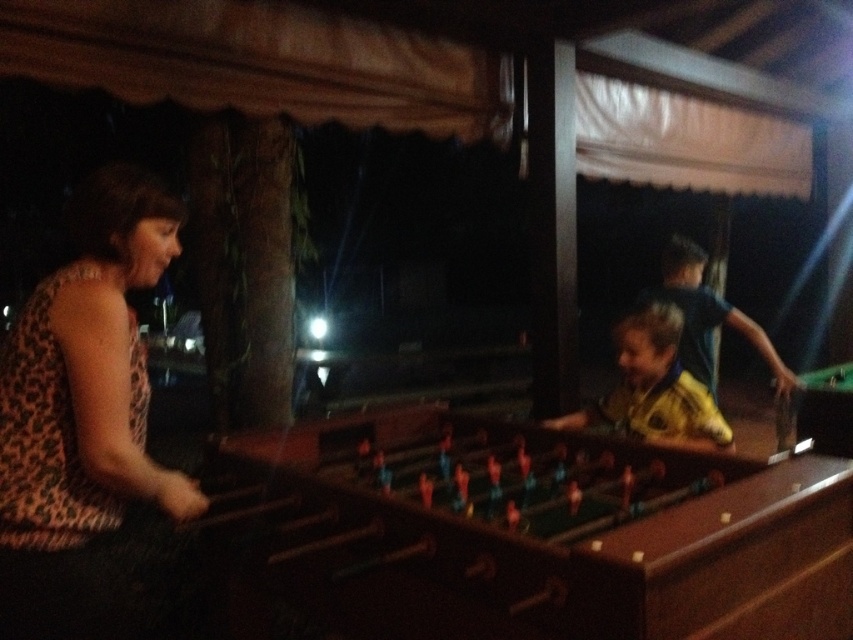
Can you confirm if brown wooden foosball table at center is positioned below leopard print fabric at left?

Indeed, brown wooden foosball table at center is positioned under leopard print fabric at left.

Which is more to the right, brown wooden foosball table at center or leopard print fabric at left?

brown wooden foosball table at center is more to the right.

Does point (247, 449) lie behind point (44, 529)?

Yes.

Locate an element on the screen. brown wooden foosball table at center is located at coordinates (535, 532).

Where is `leopard print fabric at left`? The width and height of the screenshot is (853, 640). leopard print fabric at left is located at coordinates (84, 419).

Can you confirm if leopard print fabric at left is thinner than yellow jersey at center?

Correct, leopard print fabric at left's width is less than yellow jersey at center's.

Is point (86, 456) positioned in front of point (613, 400)?

Yes.

What are the coordinates of `leopard print fabric at left` in the screenshot? It's located at (84, 419).

Looking at this image, is brown wooden foosball table at center shorter than yellow jersey at center?

In fact, brown wooden foosball table at center may be taller than yellow jersey at center.

Is brown wooden foosball table at center thinner than yellow jersey at center?

Incorrect, brown wooden foosball table at center's width is not less than yellow jersey at center's.

Who is more forward, (822,580) or (675,372)?

Point (822,580) is more forward.

Where is `brown wooden foosball table at center`? This screenshot has width=853, height=640. brown wooden foosball table at center is located at coordinates (535, 532).